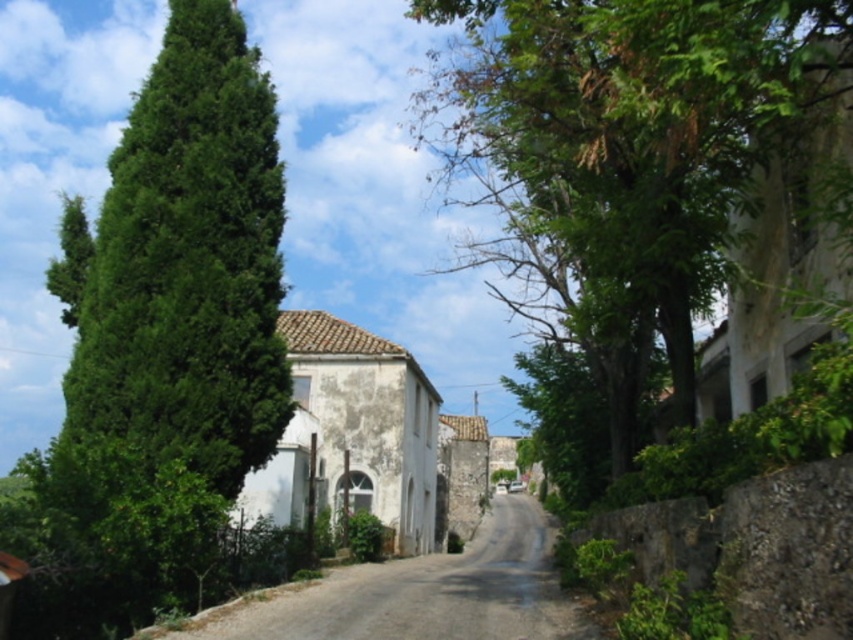
What do you see at coordinates (177, 314) in the screenshot? The height and width of the screenshot is (640, 853). I see `green leafy tree at left` at bounding box center [177, 314].

Who is positioned more to the right, green leafy tree at left or smooth stone wall at left?

Positioned to the right is smooth stone wall at left.

The image size is (853, 640). Identify the location of green leafy tree at left. (177, 314).

Between point (573, 61) and point (560, 614), which one is positioned behind?

The point (560, 614) is behind.

Between green leafy tree at center and smooth stone wall at left, which one is positioned higher?

Positioned higher is green leafy tree at center.

Image resolution: width=853 pixels, height=640 pixels. Describe the element at coordinates (654, 195) in the screenshot. I see `green leafy tree at center` at that location.

Identify the location of green leafy tree at center. The width and height of the screenshot is (853, 640). (654, 195).

Measure the distance from green leafy tree at center to green leafy tree at left.

green leafy tree at center is 28.27 meters away from green leafy tree at left.

Is green leafy tree at center shorter than green leafy tree at left?

No.

Identify the location of green leafy tree at center. (654, 195).

Locate an element on the screen. green leafy tree at center is located at coordinates (654, 195).